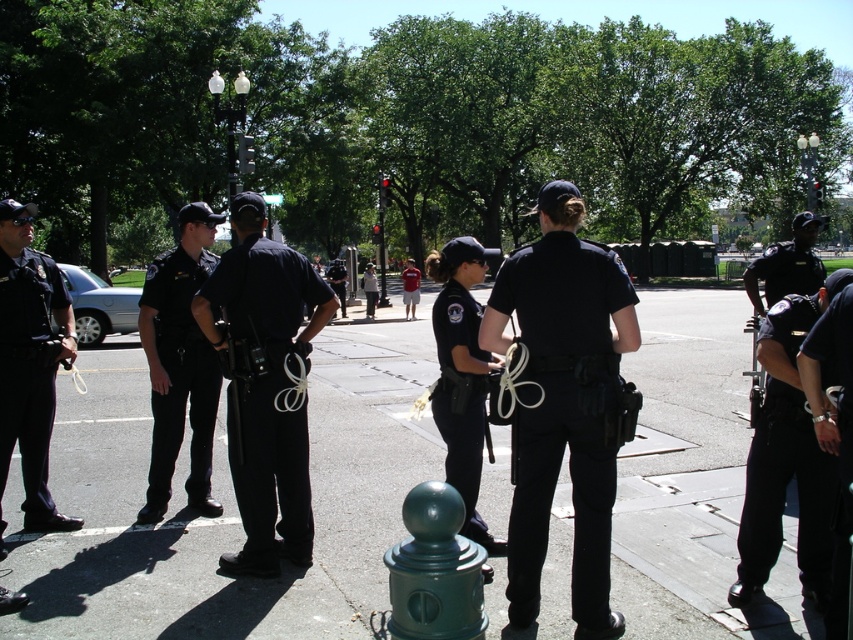
Can you confirm if black matte uniform at right is wider than matte black uniform at left?

Indeed, black matte uniform at right has a greater width compared to matte black uniform at left.

Does black matte uniform at right appear on the left side of matte black uniform at left?

No, black matte uniform at right is not to the left of matte black uniform at left.

Between point (799, 568) and point (39, 305), which one is positioned behind?

Point (39, 305)

Where is `black matte uniform at right`? black matte uniform at right is located at coordinates (786, 456).

Is point (715, 544) positioned after point (55, 525)?

No.

Which is in front, point (79, 612) or point (49, 298)?

Point (79, 612)

I want to click on green rubber fire hydrant at center, so click(x=229, y=504).

Does matte black uniform at left appear under green matte hydrant at lower center?

Actually, matte black uniform at left is above green matte hydrant at lower center.

Who is shorter, matte black uniform at left or green matte hydrant at lower center?

green matte hydrant at lower center

Describe the element at coordinates (28, 364) in the screenshot. I see `matte black uniform at left` at that location.

Locate an element on the screen. matte black uniform at left is located at coordinates (28, 364).